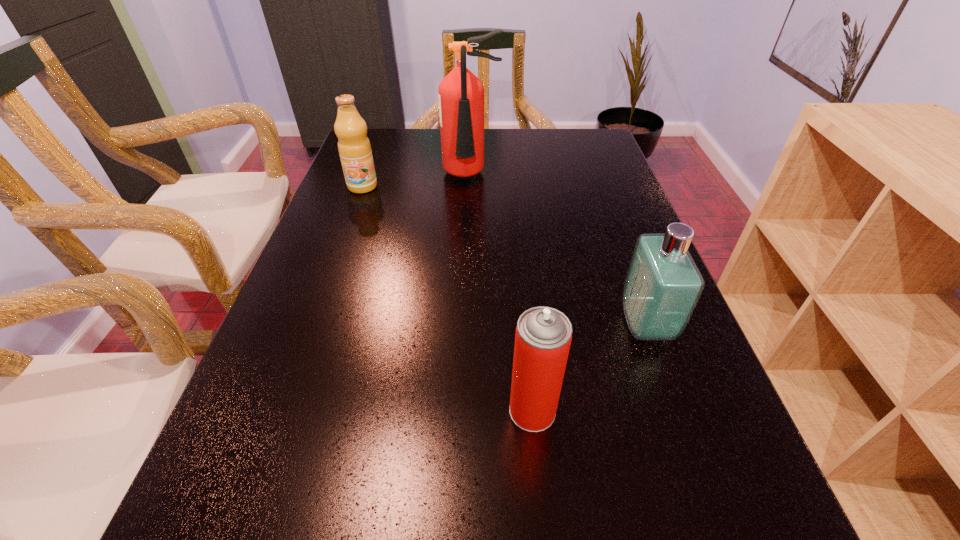
Locate an element on the screen. This screenshot has height=540, width=960. empty space between the leftmost object and the fire extinguisher is located at coordinates (417, 181).

This screenshot has height=540, width=960. In order to click on vacant region between the fire extinguisher and the aerosol can in this screenshot , I will do `click(501, 294)`.

The image size is (960, 540). In order to click on empty space between the leftmost object and the third farthest object in this screenshot , I will do `click(504, 256)`.

Identify the location of free space between the perfume and the fire extinguisher. (558, 251).

The image size is (960, 540). Identify the location of empty space between the leftmost object and the third farthest object. (504, 256).

The width and height of the screenshot is (960, 540). What are the coordinates of `unoccupied area between the fruit juice and the fire extinguisher` in the screenshot? It's located at 417,181.

Where is `unoccupied area between the perfume and the leftmost object`? This screenshot has height=540, width=960. unoccupied area between the perfume and the leftmost object is located at coordinates (504, 256).

Where is `unoccupied position between the tallest object and the rightmost object`? The image size is (960, 540). unoccupied position between the tallest object and the rightmost object is located at coordinates (558, 251).

The height and width of the screenshot is (540, 960). In order to click on free space between the nearest object and the fruit juice in this screenshot , I will do `click(447, 299)`.

At what (x,y) coordinates should I click in order to perform the action: click on the third closest object to the fire extinguisher. Please return your answer as a coordinate pair (x, y). The height and width of the screenshot is (540, 960). Looking at the image, I should click on (543, 336).